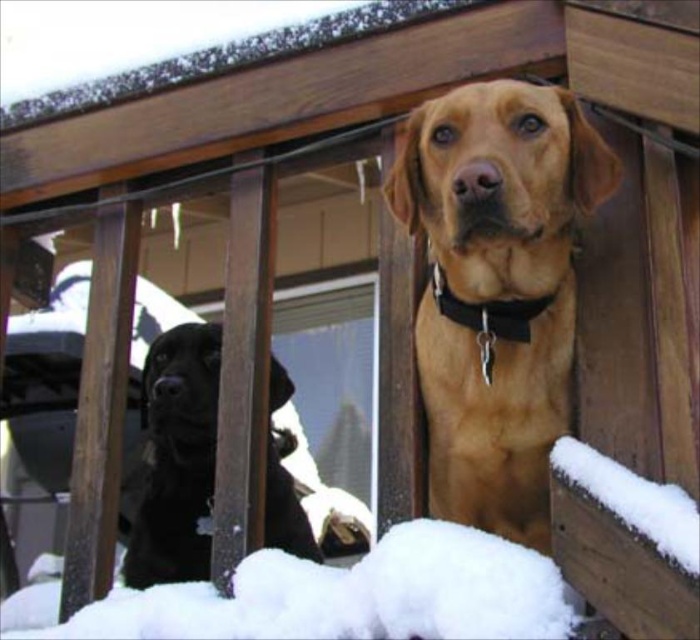
You are a small robot with a width of 30 centimeters. You need to move from the shiny black dog at left to the white fluffy snow at lower center. Is there enough space for you to pass through the area between them?

The distance between the white fluffy snow at lower center and the shiny black dog at left is 49.45 centimeters. Since your width is 30 centimeters, you can pass through the space between them as there is sufficient room.

You are standing on the wooden deck and want to throw a ball to the golden fur dog at center. Since the white fluffy snow at lower center is in the way, will the ball have to go over or under it to reach the dog?

The golden fur dog at center is located above the white fluffy snow at lower center, so the ball will have to go over the white fluffy snow at lower center to reach the dog.

You are trying to determine if there is enough space to place a small bird feeder between the white fluffy snow at lower center and the shiny black dog at left. Based on the scene, can you tell if the space between them is wide enough?

The white fluffy snow at lower center might be wider than shiny black dog at left, so there is a possibility that the space between them is sufficient to place the small bird feeder.